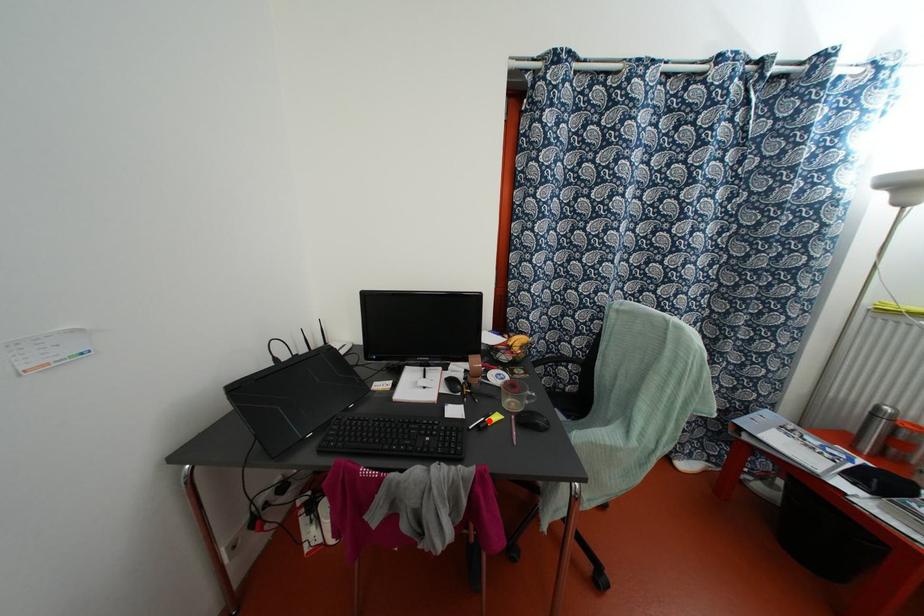
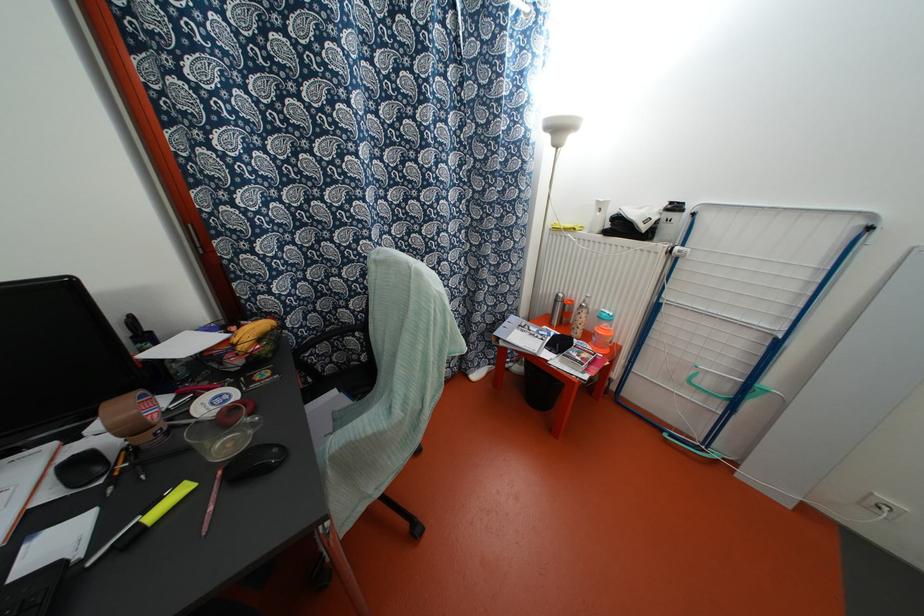
In the second image, find the point that corresponds to the highlighted location in the first image.

(152, 515)